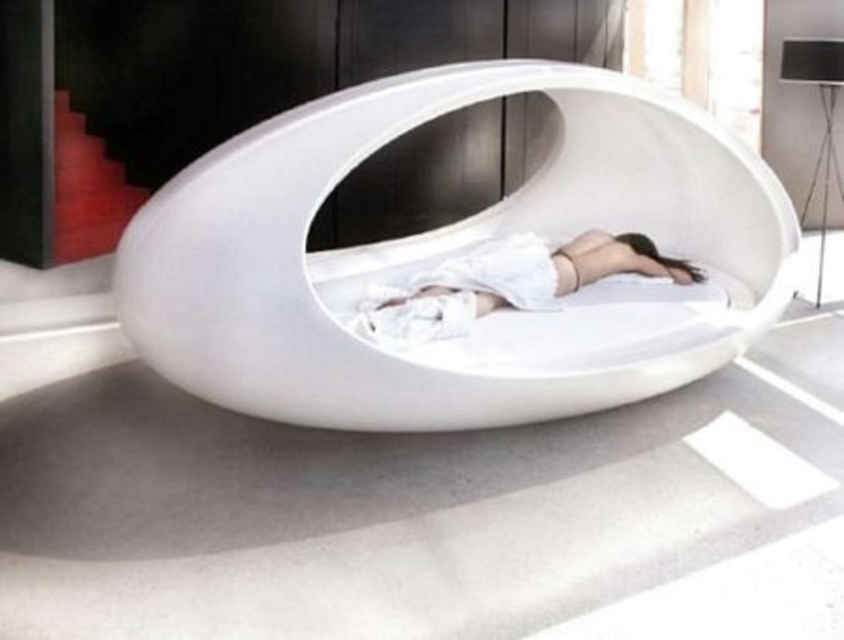
Question: Which point is closer to the camera taking this photo?

Choices:
 (A) (293, 330)
 (B) (431, 300)

Answer: (A)

Question: Is white glossy bed at center in front of white matte fabric at center?

Choices:
 (A) no
 (B) yes

Answer: (B)

Question: Observing the image, what is the correct spatial positioning of white glossy bed at center in reference to white matte fabric at center?

Choices:
 (A) right
 (B) left

Answer: (B)

Question: Among these objects, which one is nearest to the camera?

Choices:
 (A) white glossy bed at center
 (B) white matte fabric at center

Answer: (A)

Question: From the image, what is the correct spatial relationship of white glossy bed at center in relation to white matte fabric at center?

Choices:
 (A) left
 (B) right

Answer: (A)